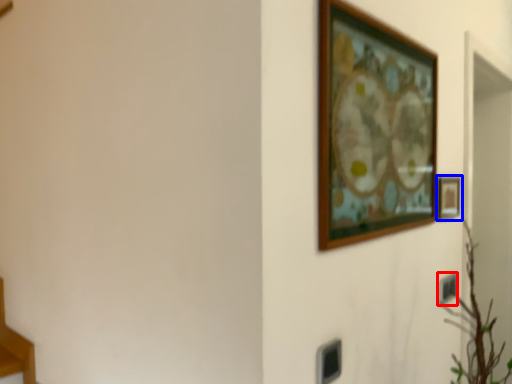
Question: Which point is further to the camera, electric outlet (highlighted by a red box) or picture frame (highlighted by a blue box)?

Choices:
 (A) electric outlet
 (B) picture frame

Answer: (A)